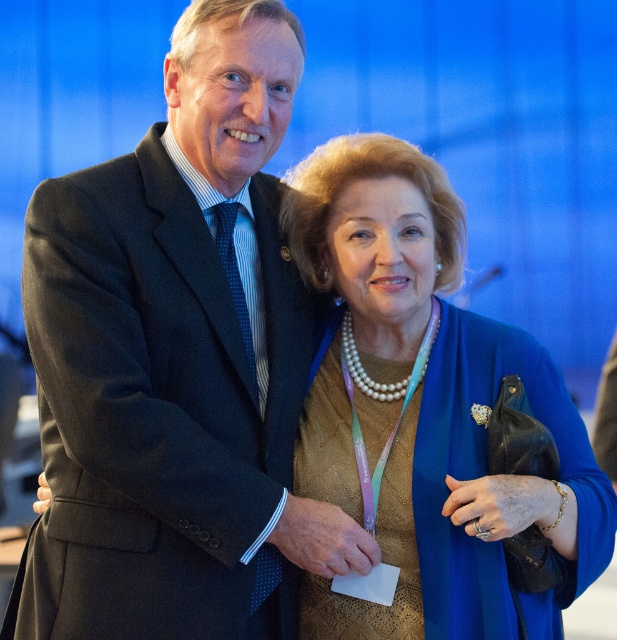
Can you confirm if dark gray suit at center is positioned above pearl necklace at center?

Indeed, dark gray suit at center is positioned over pearl necklace at center.

Is dark gray suit at center to the left of pearl necklace at center from the viewer's perspective?

Yes, dark gray suit at center is to the left of pearl necklace at center.

I want to click on dark gray suit at center, so click(x=173, y=358).

At what (x,y) coordinates should I click in order to perform the action: click on dark gray suit at center. Please return your answer as a coordinate pair (x, y). The width and height of the screenshot is (617, 640). Looking at the image, I should click on (173, 358).

Does pearl necklace at center have a smaller size compared to blue dotted tie at center?

No, pearl necklace at center is not smaller than blue dotted tie at center.

You are a GUI agent. You are given a task and a screenshot of the screen. Output one action in this format:
    pyautogui.click(x=<x>, y=<y>)
    Task: Click on the pearl necklace at center
    
    Given the screenshot: What is the action you would take?
    pyautogui.click(x=424, y=412)

Where is `pearl necklace at center`? This screenshot has height=640, width=617. pearl necklace at center is located at coordinates (424, 412).

Is dark gray suit at center positioned in front of blue dotted tie at center?

Yes, dark gray suit at center is closer to the viewer.

Looking at this image, who is taller, dark gray suit at center or blue dotted tie at center?

dark gray suit at center

You are a GUI agent. You are given a task and a screenshot of the screen. Output one action in this format:
    pyautogui.click(x=<x>, y=<y>)
    Task: Click on the dark gray suit at center
    Image resolution: width=617 pixels, height=640 pixels.
    Given the screenshot: What is the action you would take?
    (173, 358)

Identify the location of dark gray suit at center. (173, 358).